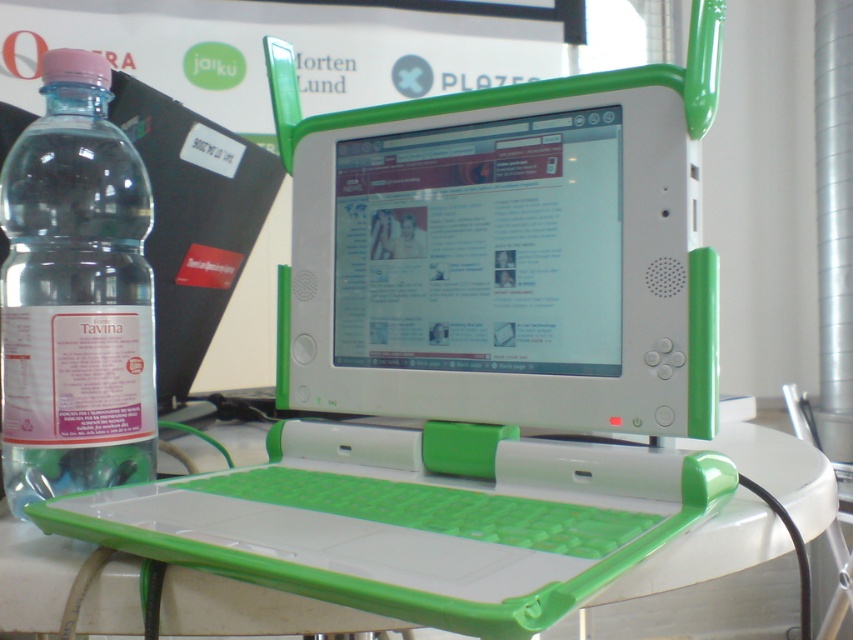
Question: Can you confirm if green plastic computer monitor at center is positioned to the left of clear plastic bottle at left?

Choices:
 (A) no
 (B) yes

Answer: (A)

Question: Considering the real-world distances, which object is farthest from the green plastic computer monitor at center?

Choices:
 (A) clear plastic bottle at left
 (B) white plastic table at center

Answer: (B)

Question: Which point is farther from the camera taking this photo?

Choices:
 (A) tap(181, 460)
 (B) tap(693, 236)
 (C) tap(7, 483)

Answer: (A)

Question: Which object is positioned closest to the clear plastic bottle at left?

Choices:
 (A) green plastic computer monitor at center
 (B) white plastic table at center

Answer: (B)

Question: Is green plastic computer monitor at center below clear plastic bottle at left?

Choices:
 (A) no
 (B) yes

Answer: (A)

Question: Can you confirm if green plastic computer monitor at center is positioned below white plastic table at center?

Choices:
 (A) no
 (B) yes

Answer: (A)